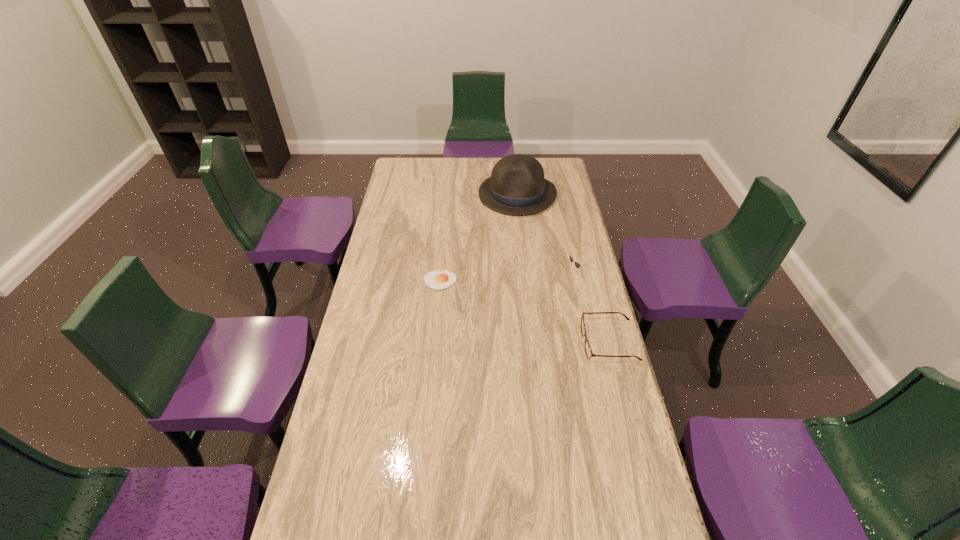
The image size is (960, 540). I want to click on free space between the leftmost object and the third tallest object, so click(x=524, y=312).

You are a GUI agent. You are given a task and a screenshot of the screen. Output one action in this format:
    pyautogui.click(x=<x>, y=<y>)
    Task: Click on the vacant area between the shortest object and the nearest object
    The width and height of the screenshot is (960, 540).
    Given the screenshot: What is the action you would take?
    pyautogui.click(x=524, y=312)

Where is `free space between the spectacles and the sunglasses`? This screenshot has width=960, height=540. free space between the spectacles and the sunglasses is located at coordinates (592, 308).

Where is `empty location between the shortest object and the spectacles`? empty location between the shortest object and the spectacles is located at coordinates (524, 312).

Where is `vacant space in between the shortest object and the nearest object`? vacant space in between the shortest object and the nearest object is located at coordinates (524, 312).

Find the location of a particular element. The image size is (960, 540). vacant area that lies between the third shortest object and the bowler hat is located at coordinates (547, 234).

Find the location of a particular element. unoccupied area between the egg yolk and the farthest object is located at coordinates (479, 238).

Locate an element on the screen. The width and height of the screenshot is (960, 540). free space between the tallest object and the sunglasses is located at coordinates (547, 234).

In order to click on vacant area that lies between the nearest object and the sunglasses in this screenshot , I will do `click(592, 308)`.

Select which object is the closest to the nearest object. Please provide its 2D coordinates. Your answer should be formatted as a tuple, i.e. [(x, y)], where the tuple contains the x and y coordinates of a point satisfying the conditions above.

[(577, 265)]